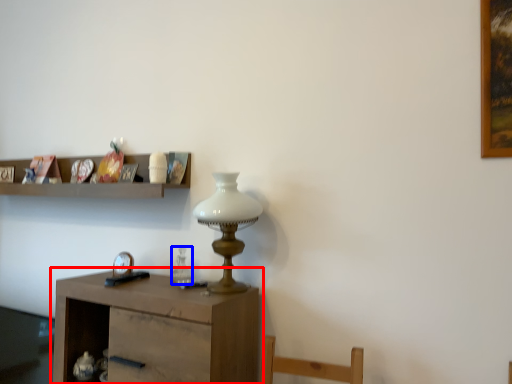
Question: Which point is closer to the camera, table (highlighted by a red box) or glass vase (highlighted by a blue box)?

Choices:
 (A) table
 (B) glass vase

Answer: (A)